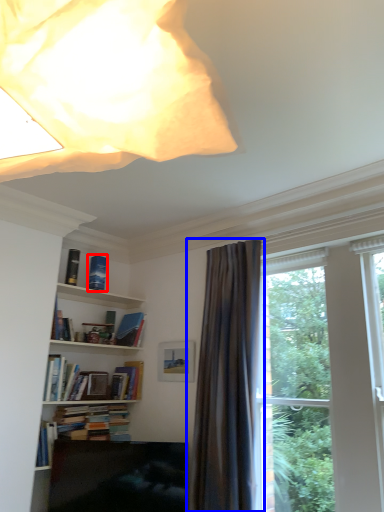
Question: Among these objects, which one is farthest to the camera, book (highlighted by a red box) or curtain (highlighted by a blue box)?

Choices:
 (A) book
 (B) curtain

Answer: (A)